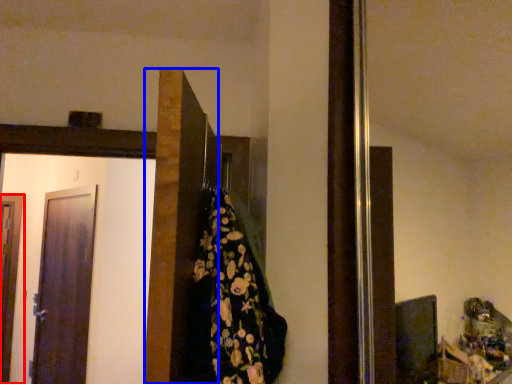
Question: Which object appears closest to the camera in this image, door (highlighted by a red box) or door (highlighted by a blue box)?

Choices:
 (A) door
 (B) door

Answer: (B)